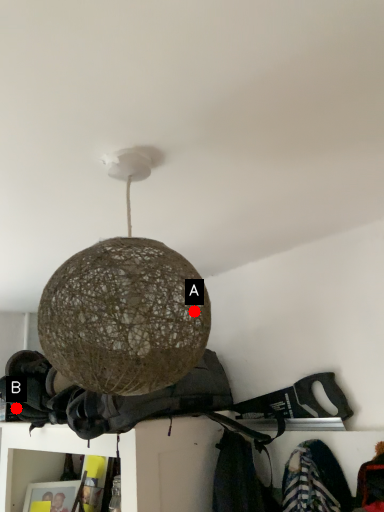
Question: Two points are circled on the image, labeled by A and B beside each circle. Among these points, which one is nearest to the camera?

Choices:
 (A) A is closer
 (B) B is closer

Answer: (A)